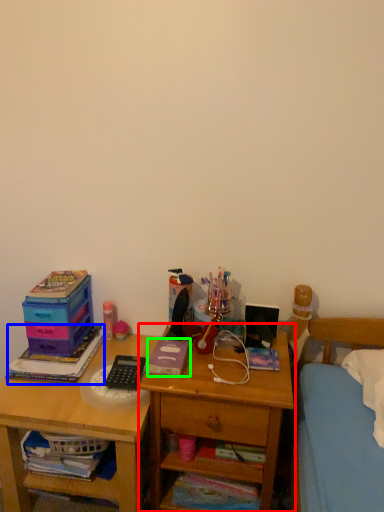
Question: Which object is the farthest from nightstand (highlighted by a red box)? Choose among these: book (highlighted by a blue box) or book (highlighted by a green box).

Choices:
 (A) book
 (B) book

Answer: (A)